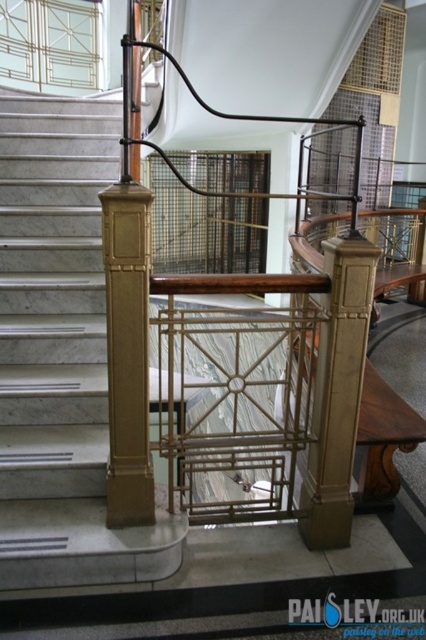
You are standing at the bottom of the staircase and want to reach a decorative item placed at point (141, 545). There is an obstacle at point (314, 422). Can you walk directly to the decorative item without going around the obstacle?

Yes, you can walk directly to the decorative item at point (141, 545) because it is in front of the obstacle at point (314, 422), meaning the obstacle is behind the decorative item and won

From the picture: You are an interior designer assessing the space between the matte gold stair at left and the gold polished wood pillar at center. If you want to place a decorative bench between them, what should you consider about their widths?

The matte gold stair at left is wider than the gold polished wood pillar at center, so the bench must be designed to accommodate the wider space between them.